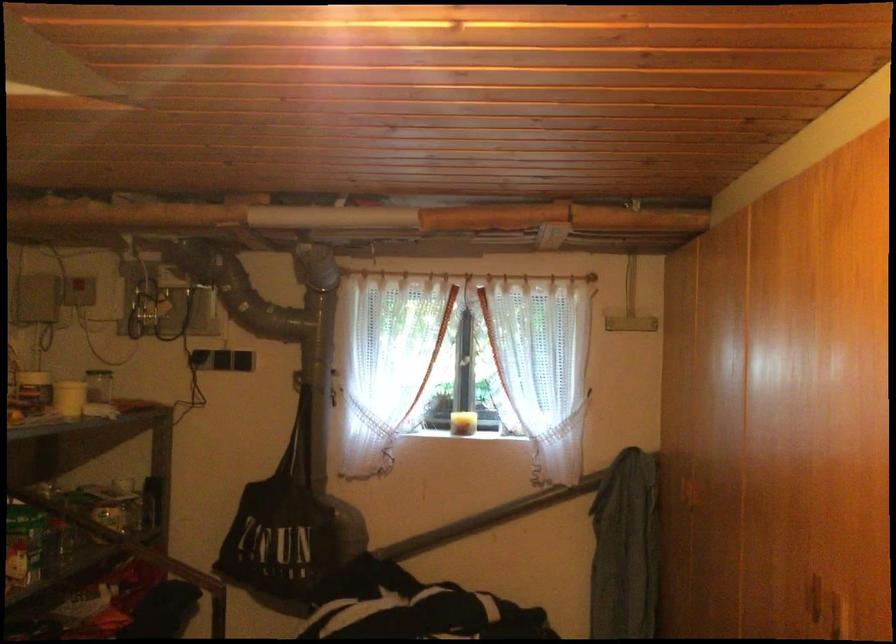
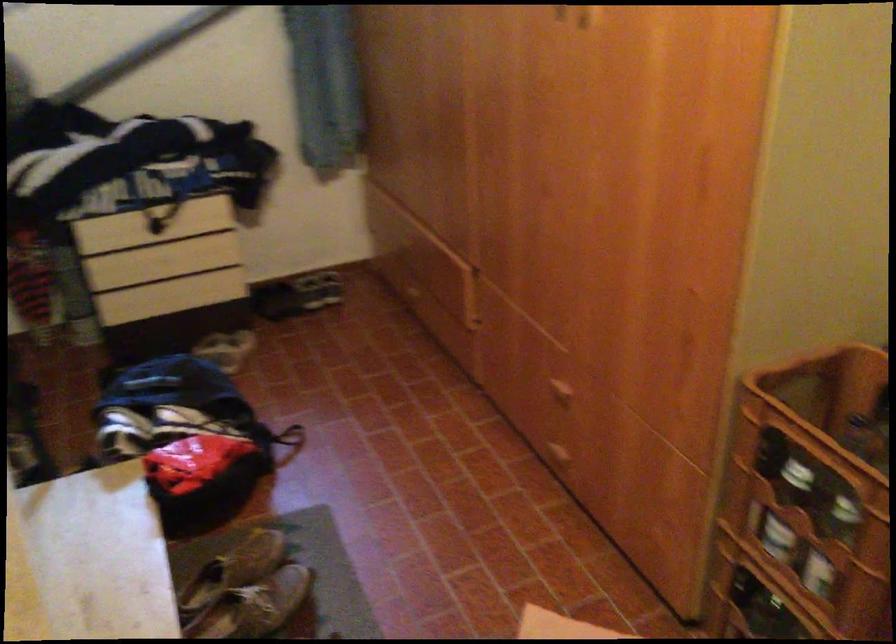
Based on the continuous images, in which direction is the camera rotating?

The rotation direction of the camera is right-down.